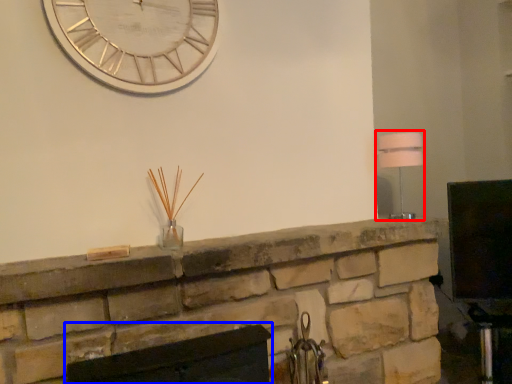
Question: Which of the following is the closest to the observer, lamp (highlighted by a red box) or fireplace (highlighted by a blue box)?

Choices:
 (A) lamp
 (B) fireplace

Answer: (B)